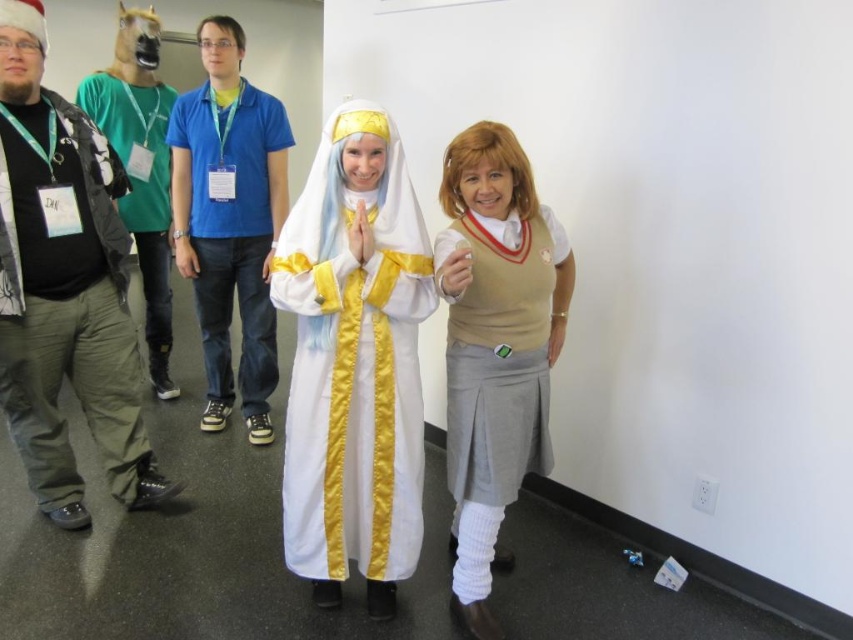
Does point (537, 212) come closer to viewer compared to point (236, 104)?

Yes, it is.

Is beige knit sweater at center thinner than blue cotton shirt at center?

Yes, beige knit sweater at center is thinner than blue cotton shirt at center.

At what (x,y) coordinates should I click in order to perform the action: click on beige knit sweater at center. Please return your answer as a coordinate pair (x, y). This screenshot has width=853, height=640. Looking at the image, I should click on pyautogui.click(x=495, y=346).

Does white satin robe at center have a greater width compared to beige knit sweater at center?

Indeed, white satin robe at center has a greater width compared to beige knit sweater at center.

Does white satin robe at center lie behind beige knit sweater at center?

Yes, white satin robe at center is further from the viewer.

Locate an element on the screen. The width and height of the screenshot is (853, 640). white satin robe at center is located at coordinates (352, 358).

Measure the distance between point (x=384, y=342) and camera.

Point (x=384, y=342) is 6.41 feet away from camera.

Is white satin robe at center shorter than blue cotton shirt at center?

Indeed, white satin robe at center has a lesser height compared to blue cotton shirt at center.

Is point (318, 380) closer to viewer compared to point (257, 200)?

That is True.

Find the location of a particular element. The width and height of the screenshot is (853, 640). white satin robe at center is located at coordinates (352, 358).